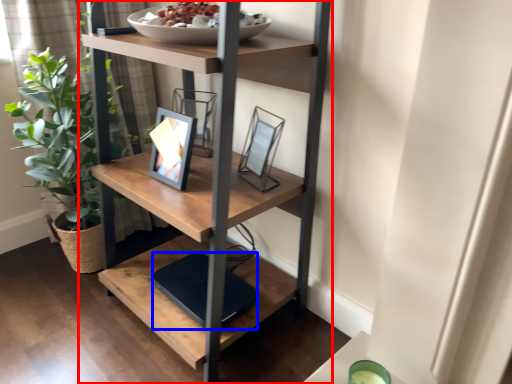
Question: Which object appears farthest to the camera in this image, shelf (highlighted by a red box) or lift (highlighted by a blue box)?

Choices:
 (A) shelf
 (B) lift

Answer: (B)